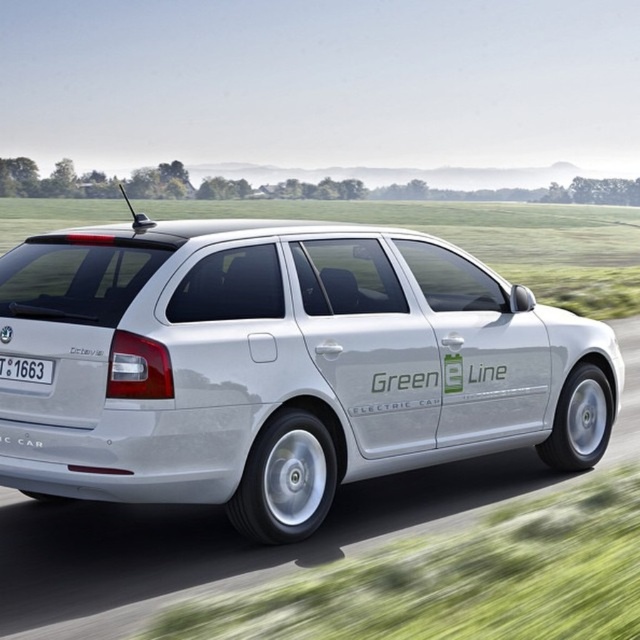
Is point (269, 396) positioned after point (12, 360)?

That is True.

Is white metallic car at center to the right of white plastic license plate at rear from the viewer's perspective?

Yes, white metallic car at center is to the right of white plastic license plate at rear.

You are a GUI agent. You are given a task and a screenshot of the screen. Output one action in this format:
    pyautogui.click(x=<x>, y=<y>)
    Task: Click on the white metallic car at center
    The image size is (640, 640).
    Given the screenshot: What is the action you would take?
    pyautogui.click(x=280, y=365)